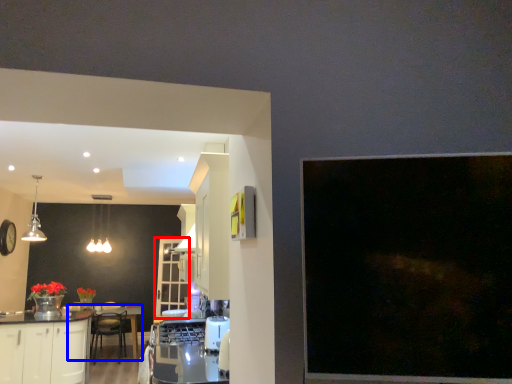
Question: Which object appears closest to the camera in this image, glass door (highlighted by a red box) or round table (highlighted by a blue box)?

Choices:
 (A) glass door
 (B) round table

Answer: (B)